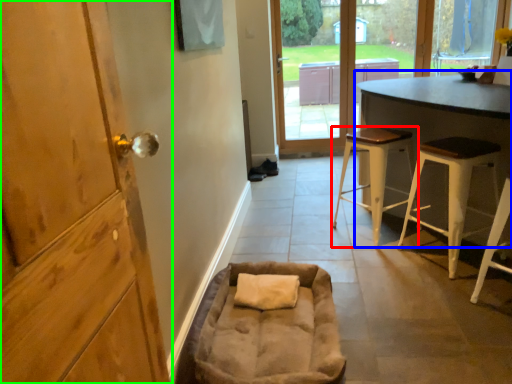
Question: Considering the real-world distances, which object is farthest from stool (highlighted by a red box)? table (highlighted by a blue box) or door (highlighted by a green box)?

Choices:
 (A) table
 (B) door

Answer: (B)